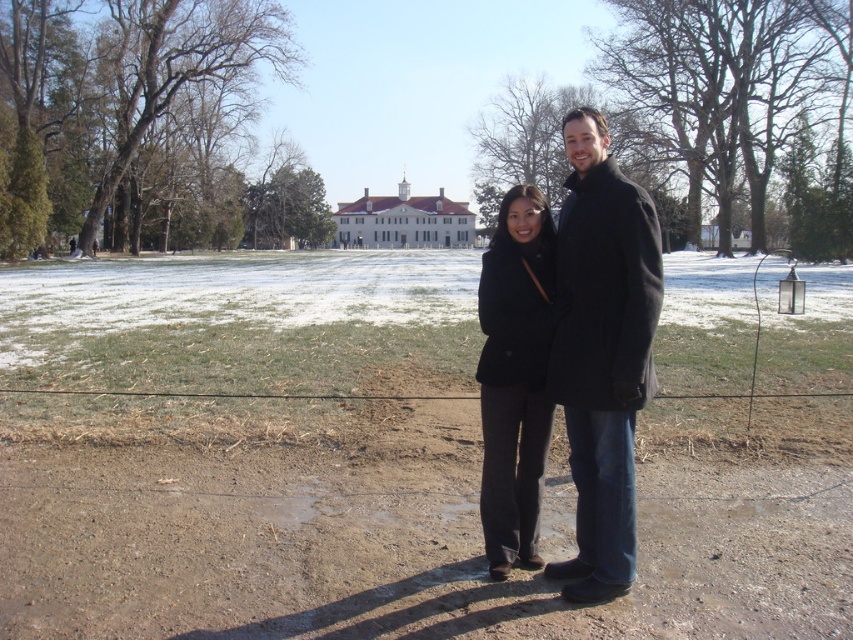
Does black wool coat at center come behind black matte coat at center?

No.

Can you confirm if black wool coat at center is thinner than black matte coat at center?

Incorrect, black wool coat at center's width is not less than black matte coat at center's.

What do you see at coordinates (602, 352) in the screenshot?
I see `black wool coat at center` at bounding box center [602, 352].

At what (x,y) coordinates should I click in order to perform the action: click on black wool coat at center. Please return your answer as a coordinate pair (x, y). Looking at the image, I should click on (602, 352).